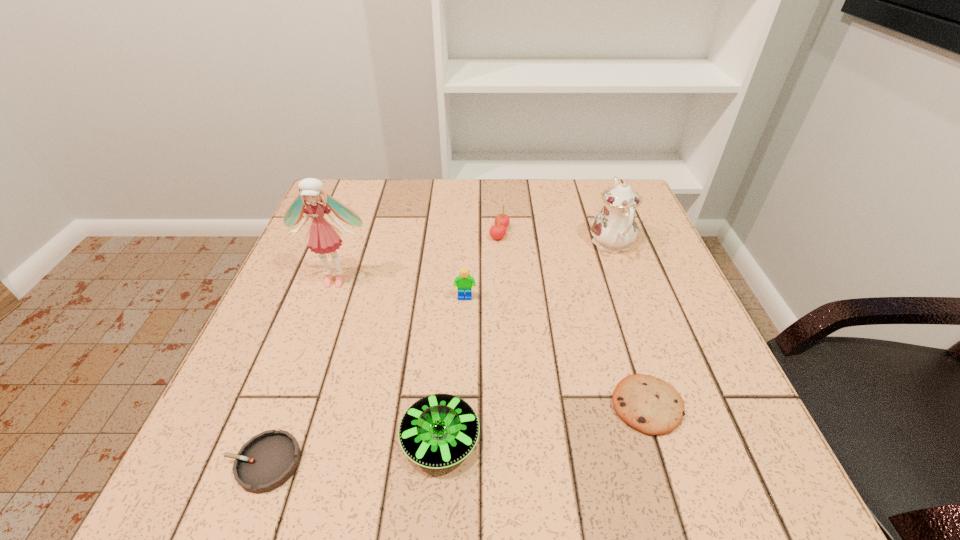
You are a GUI agent. You are given a task and a screenshot of the screen. Output one action in this format:
    pyautogui.click(x=<x>, y=<y>)
    Task: Click on the doll that is at the left edge
    This screenshot has height=540, width=960.
    Given the screenshot: What is the action you would take?
    pyautogui.click(x=322, y=237)

This screenshot has width=960, height=540. I want to click on ashtray at the left edge, so click(265, 462).

Where is `chinaware at the right edge`? This screenshot has height=540, width=960. chinaware at the right edge is located at coordinates (614, 228).

Image resolution: width=960 pixels, height=540 pixels. Find the location of `cookie that is at the right edge`. cookie that is at the right edge is located at coordinates (650, 405).

Where is `object present at the near left corner`? object present at the near left corner is located at coordinates (265, 462).

This screenshot has height=540, width=960. In order to click on object that is at the far right corner in this screenshot , I will do `click(614, 228)`.

In the image, there is a desktop. Identify the location of vacant space at the far edge. The width and height of the screenshot is (960, 540). pyautogui.click(x=434, y=192).

Locate an element on the screen. vacant region at the near edge is located at coordinates (396, 490).

In the image, there is a desktop. Identify the location of vacant space at the left edge. (270, 387).

This screenshot has width=960, height=540. Find the location of `vacant point at the right edge`. vacant point at the right edge is located at coordinates (645, 333).